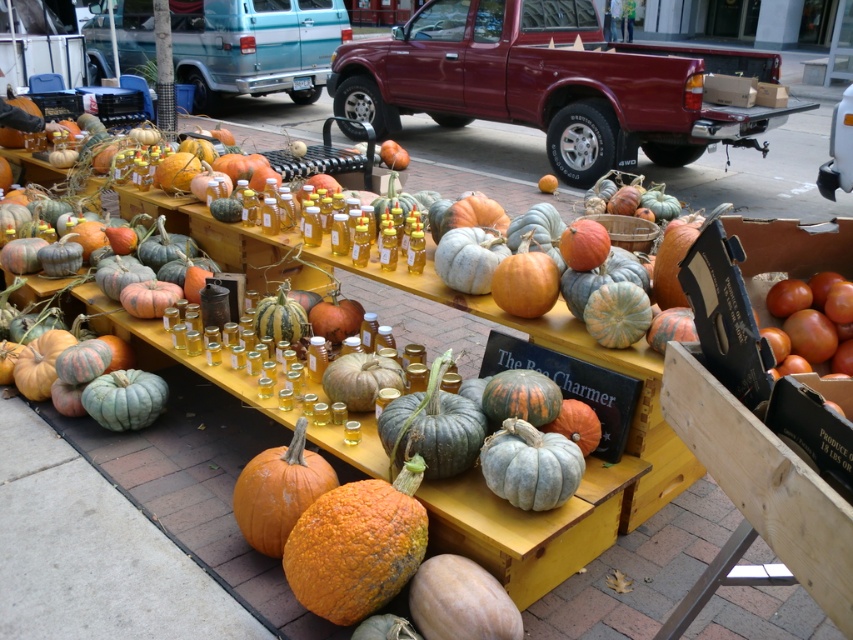
Question: Which is nearer to the matte orange pumpkin at center?

Choices:
 (A) orange rough pumpkin at center
 (B) speckled gray pumpkin at center
 (C) orange matte pumpkin at center

Answer: (A)

Question: Is orange matte pumpkin at center smaller than matte orange pumpkin at center?

Choices:
 (A) no
 (B) yes

Answer: (A)

Question: Observing the image, what is the correct spatial positioning of orange matte pumpkin at center in reference to speckled gray pumpkin at center?

Choices:
 (A) above
 (B) below

Answer: (B)

Question: Which of these objects is positioned closest to the speckled gray pumpkin at center?

Choices:
 (A) orange rough pumpkin at center
 (B) orange matte pumpkin at center
 (C) matte orange pumpkin at center

Answer: (C)

Question: Which point is closer to the camera?

Choices:
 (A) orange matte pumpkin at center
 (B) orange rough pumpkin at center
 (C) matte orange pumpkin at center
 (D) speckled gray pumpkin at center

Answer: (C)

Question: Is orange rough pumpkin at center thinner than speckled gray pumpkin at center?

Choices:
 (A) no
 (B) yes

Answer: (A)